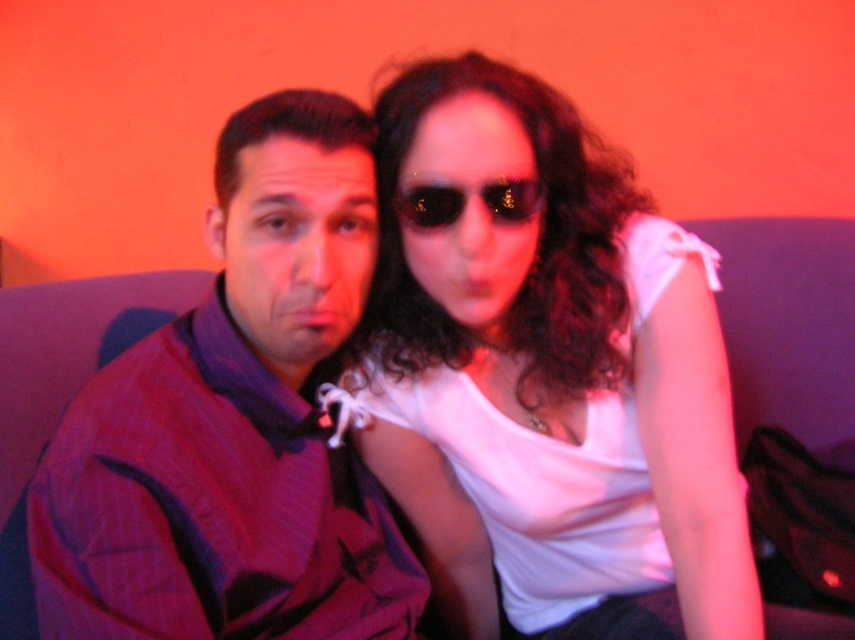
Question: Which of the following is the closest to the observer?

Choices:
 (A) purple striped shirt at left
 (B) white matte tank top at center

Answer: (A)

Question: Among these points, which one is nearest to the camera?

Choices:
 (A) (133, 518)
 (B) (422, 216)
 (C) (616, 164)

Answer: (A)

Question: Is white matte tank top at center wider than purple striped shirt at left?

Choices:
 (A) no
 (B) yes

Answer: (B)

Question: Can you confirm if white matte tank top at center is wider than black reflective sunglasses at center?

Choices:
 (A) yes
 (B) no

Answer: (A)

Question: Which of the following is the closest to the observer?

Choices:
 (A) (522, 188)
 (B) (139, 372)

Answer: (B)

Question: Does purple striped shirt at left have a smaller size compared to black reflective sunglasses at center?

Choices:
 (A) yes
 (B) no

Answer: (B)